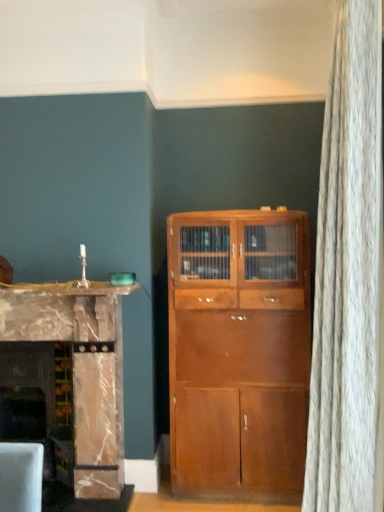
Question: Is marble fireplace at left at the right side of shiny brown cabinet at center?

Choices:
 (A) yes
 (B) no

Answer: (B)

Question: From a real-world perspective, does marble fireplace at left sit lower than shiny brown cabinet at center?

Choices:
 (A) no
 (B) yes

Answer: (A)

Question: Considering the relative sizes of marble fireplace at left and shiny brown cabinet at center in the image provided, is marble fireplace at left smaller than shiny brown cabinet at center?

Choices:
 (A) yes
 (B) no

Answer: (A)

Question: Is marble fireplace at left far away from shiny brown cabinet at center?

Choices:
 (A) no
 (B) yes

Answer: (A)

Question: Is marble fireplace at left oriented away from shiny brown cabinet at center?

Choices:
 (A) yes
 (B) no

Answer: (B)

Question: Is shiny brown cabinet at center inside or outside of marble fireplace at left?

Choices:
 (A) inside
 (B) outside

Answer: (B)

Question: From the image's perspective, is shiny brown cabinet at center located above or below marble fireplace at left?

Choices:
 (A) below
 (B) above

Answer: (A)

Question: In terms of width, does shiny brown cabinet at center look wider or thinner when compared to marble fireplace at left?

Choices:
 (A) thin
 (B) wide

Answer: (B)

Question: Is point (190, 234) positioned closer to the camera than point (77, 294)?

Choices:
 (A) closer
 (B) farther

Answer: (B)

Question: Is marble fireplace at left taller or shorter than marble fireplace at left?

Choices:
 (A) short
 (B) tall

Answer: (B)

Question: Considering the positions of marble fireplace at left and marble fireplace at left in the image, is marble fireplace at left bigger or smaller than marble fireplace at left?

Choices:
 (A) small
 (B) big

Answer: (B)

Question: Is marble fireplace at left wider or thinner than marble fireplace at left?

Choices:
 (A) thin
 (B) wide

Answer: (B)

Question: In the image, is marble fireplace at left positioned in front of or behind marble fireplace at left?

Choices:
 (A) front
 (B) behind

Answer: (B)

Question: Based on their sizes in the image, would you say marble fireplace at left is bigger or smaller than shiny brown cabinet at center?

Choices:
 (A) small
 (B) big

Answer: (B)

Question: In terms of height, does marble fireplace at left look taller or shorter compared to shiny brown cabinet at center?

Choices:
 (A) short
 (B) tall

Answer: (A)